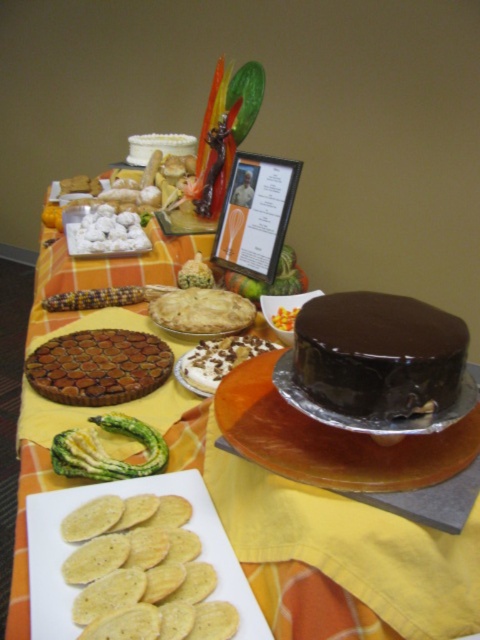
Question: Can you confirm if brown glossy tart at center-left is positioned to the left of golden flaky pie at center?

Choices:
 (A) no
 (B) yes

Answer: (B)

Question: Which point is farther to the camera?

Choices:
 (A) white fluffy marshmallows at center
 (B) chocolatesmoothcake at right
 (C) white creamy cake at center
 (D) brown glossy tart at center-left

Answer: (A)

Question: Is white creamy cake at center below white frosted cake at center?

Choices:
 (A) no
 (B) yes

Answer: (B)

Question: Is the position of golden cracker at center less distant than that of green matte asparagus at lower left?

Choices:
 (A) yes
 (B) no

Answer: (A)

Question: Which of the following is the closest to the observer?

Choices:
 (A) shiny chocolate cake at center
 (B) chocolate cake at center
 (C) white fluffy marshmallows at center
 (D) golden flaky pie at center

Answer: (A)

Question: Among these points, which one is nearest to the camera?

Choices:
 (A) (40, 323)
 (B) (141, 353)
 (C) (122, 429)

Answer: (C)